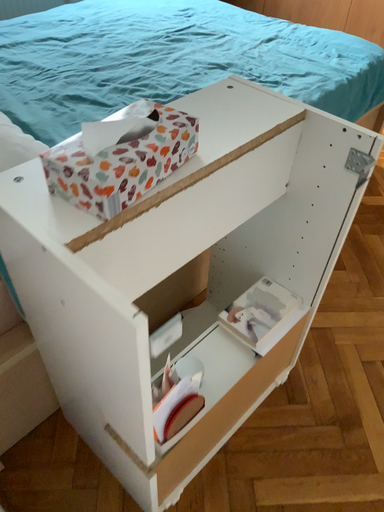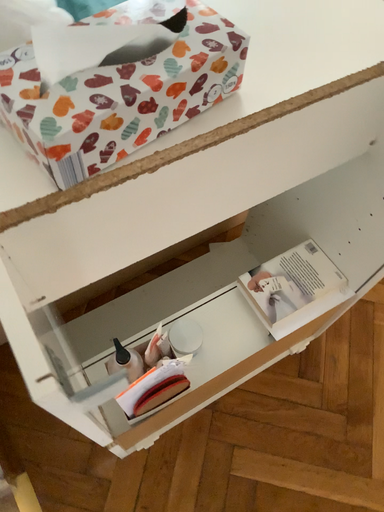
Question: Which way did the camera rotate in the video?

Choices:
 (A) rotated downward
 (B) rotated upward

Answer: (A)